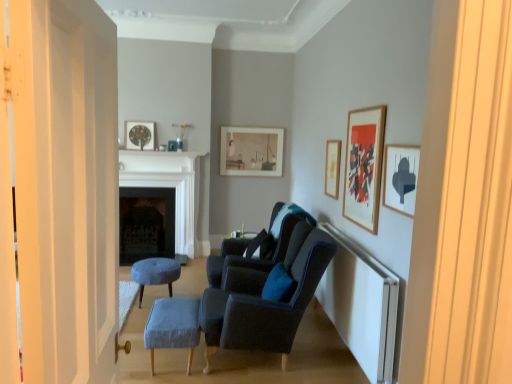
Question: From a real-world perspective, does matte black picture frame at upper right, which ranks as the fifth picture frame in back-to-front order, stand above matte black side table at center?

Choices:
 (A) yes
 (B) no

Answer: (A)

Question: From a real-world perspective, is matte black picture frame at upper right, which is the 5th picture frame from left to right, under matte black side table at center?

Choices:
 (A) yes
 (B) no

Answer: (B)

Question: From the image's perspective, does matte black picture frame at upper right, the 1th picture frame when ordered from right to left, appear lower than matte black side table at center?

Choices:
 (A) yes
 (B) no

Answer: (B)

Question: Is matte black picture frame at upper right, the 1th picture frame when ordered from right to left, further to the viewer compared to matte black side table at center?

Choices:
 (A) yes
 (B) no

Answer: (B)

Question: Considering the relative sizes of matte black picture frame at upper right, arranged as the 1th picture frame when viewed from the front, and matte black side table at center in the image provided, is matte black picture frame at upper right, arranged as the 1th picture frame when viewed from the front, shorter than matte black side table at center?

Choices:
 (A) no
 (B) yes

Answer: (A)

Question: From a real-world perspective, relative to matte gold picture frame at upper right, the third picture frame viewed from the right, is black stone fireplace at center, which is the 1th fireplace in back-to-front order, vertically above or below?

Choices:
 (A) below
 (B) above

Answer: (A)

Question: Considering the relative positions of black stone fireplace at center, which is the 1th fireplace in back-to-front order, and matte gold picture frame at upper right, the 3th picture frame when ordered from left to right, in the image provided, is black stone fireplace at center, which is the 1th fireplace in back-to-front order, to the left or to the right of matte gold picture frame at upper right, the 3th picture frame when ordered from left to right,?

Choices:
 (A) right
 (B) left

Answer: (B)

Question: Is black stone fireplace at center, which is the 1th fireplace in back-to-front order, situated inside matte gold picture frame at upper right, the 3th picture frame when ordered from left to right, or outside?

Choices:
 (A) outside
 (B) inside

Answer: (A)

Question: Considering their positions, is black stone fireplace at center, which is the 1th fireplace in back-to-front order, located in front of or behind matte gold picture frame at upper right, placed as the 3th picture frame when sorted from front to back?

Choices:
 (A) front
 (B) behind

Answer: (B)

Question: Is white marble fireplace at center, which is counted as the 2th fireplace, starting from the back, wider or thinner than black stone fireplace at center, which is the 1th fireplace in back-to-front order?

Choices:
 (A) wide
 (B) thin

Answer: (B)

Question: In terms of height, does white marble fireplace at center, which is counted as the first fireplace, starting from the front, look taller or shorter compared to black stone fireplace at center, which is the second fireplace from front to back?

Choices:
 (A) tall
 (B) short

Answer: (A)

Question: Is white marble fireplace at center, which is counted as the 2th fireplace, starting from the back, in front of or behind black stone fireplace at center, which is the 1th fireplace in back-to-front order, in the image?

Choices:
 (A) front
 (B) behind

Answer: (A)

Question: Is point (139, 183) positioned closer to the camera than point (155, 236)?

Choices:
 (A) closer
 (B) farther

Answer: (A)

Question: Does point (242, 332) appear closer or farther from the camera than point (228, 129)?

Choices:
 (A) closer
 (B) farther

Answer: (A)

Question: Is suede dark blue armchair at center, the 1th chair when ordered from front to back, to the left or to the right of matte white picture frame at center, acting as the 4th picture frame starting from the right, in the image?

Choices:
 (A) right
 (B) left

Answer: (A)